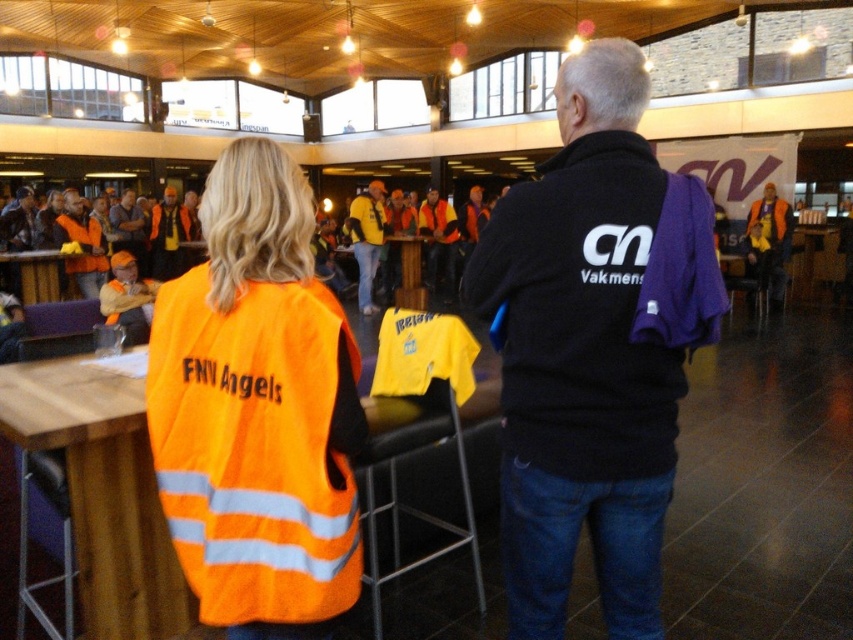
You are standing in the conference hall and see two points marked in the scene. Which point is closer to you, point (764, 234) or point (401, 243)?

Point (764, 234) is closer to the viewer than point (401, 243).